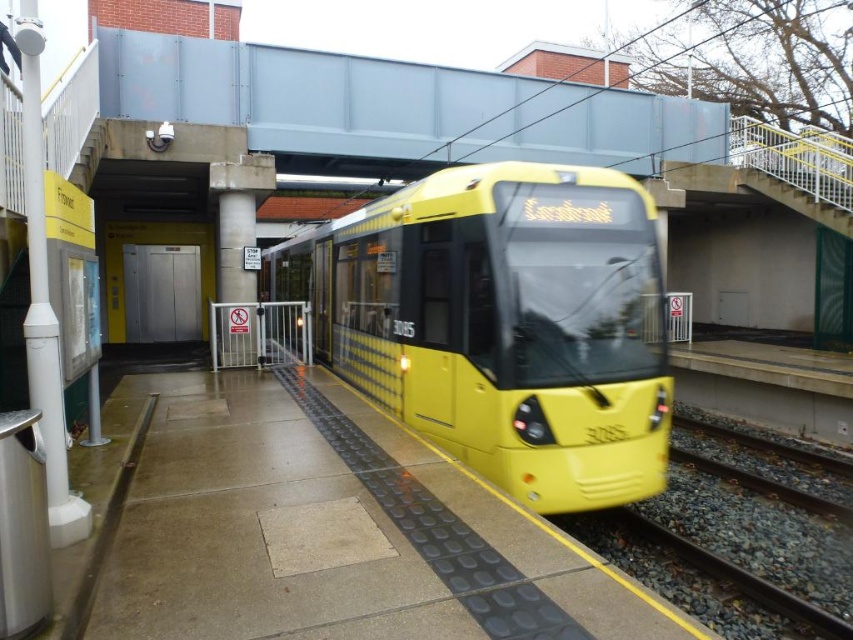
Looking at this image, does yellow matte train at center have a lesser width compared to gray concrete bridge at upper center?

Yes.

Who is lower down, yellow matte train at center or gray concrete bridge at upper center?

yellow matte train at center

This screenshot has height=640, width=853. Describe the element at coordinates (502, 323) in the screenshot. I see `yellow matte train at center` at that location.

This screenshot has width=853, height=640. I want to click on yellow matte train at center, so click(x=502, y=323).

Does yellow matte train at center have a greater height compared to gravel train track at lower right?

Correct, yellow matte train at center is much taller as gravel train track at lower right.

Who is lower down, yellow matte train at center or gravel train track at lower right?

gravel train track at lower right is lower down.

Who is more distant from viewer, (378,372) or (816,499)?

Positioned behind is point (378,372).

Locate an element on the screen. This screenshot has width=853, height=640. yellow matte train at center is located at coordinates (502, 323).

Between point (123, 106) and point (808, 538), which one is positioned behind?

Point (123, 106)

Between point (347, 106) and point (799, 496), which one is positioned in front?

Point (799, 496)

Where is `gray concrete bridge at upper center`? The width and height of the screenshot is (853, 640). gray concrete bridge at upper center is located at coordinates (395, 108).